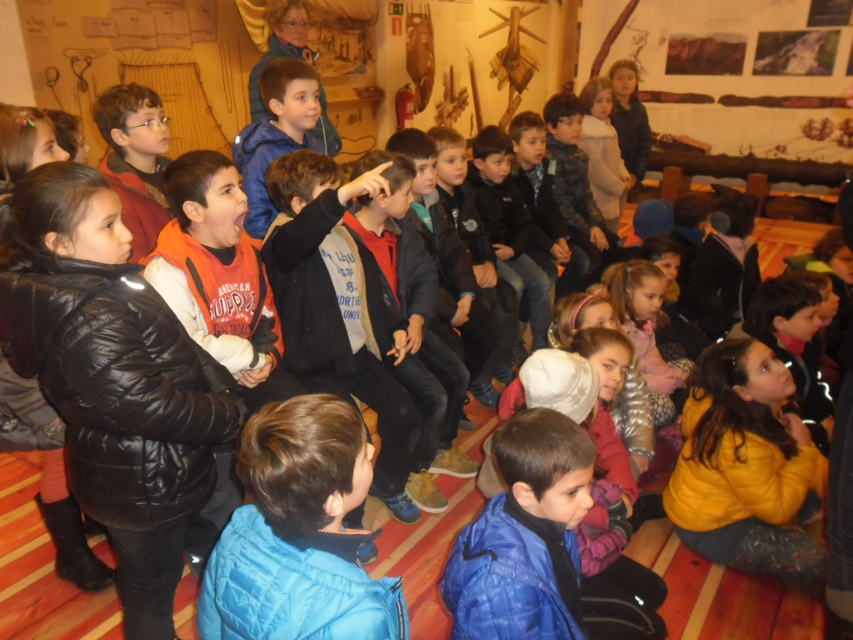
You are a photographer standing in the museum. You need to capture a photo of both the blue quilted jacket at center and the yellow fleece jacket at lower right in the same frame. Considering their sizes, which jacket will appear smaller in the photo?

The blue quilted jacket at center will appear smaller in the photo because it has a lesser width compared to the yellow fleece jacket at lower right.

You are a tour guide leading a group of children in a museum. You need to move from the blue quilted jacket at center to the yellow fleece jacket at lower right to answer a question. Can you walk directly between them without needing to step around any obstacles?

The blue quilted jacket at center and yellow fleece jacket at lower right are 5.49 feet apart, so yes, you can walk directly between them as there is sufficient space.